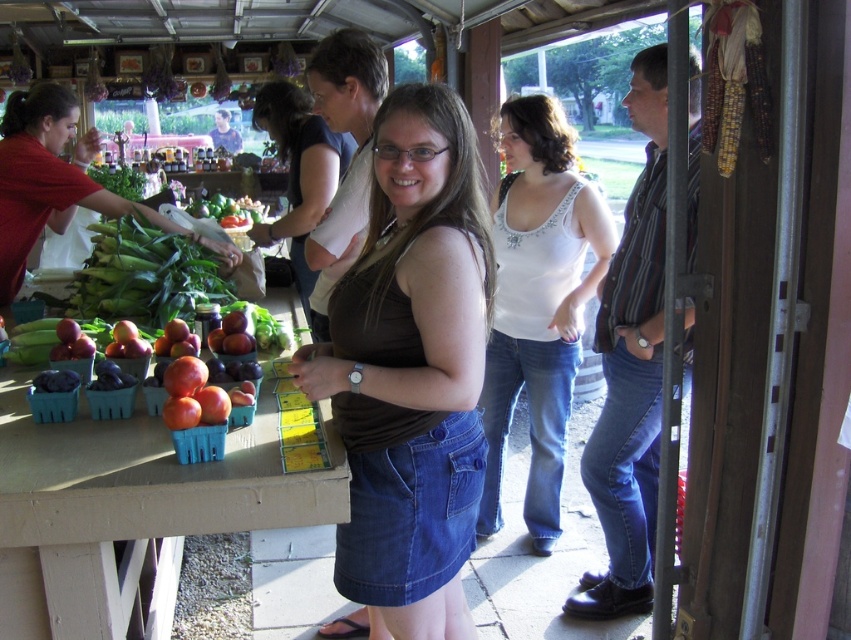
What is the exact coordinate of the matte black shirt at center?

The exact coordinate of the matte black shirt at center is at point (55, 180).

You are a customer at the farmer market who wants to pick up both the matte black shirt at center and the green leafy vegetables at center. Can you reach both items without moving your position? The average human arm span is about 1.5 meters.

The distance between the matte black shirt at center and the green leafy vegetables at center is 1.58 meters. Since the average human arm span is 1.5 meters, you might need to adjust your position slightly to reach both items.

You are a customer at the farmer market and see the white jersey at center and the green leafy vegetables at center on the table. Which item is placed lower on the table?

The white jersey at center is placed lower on the table because it is below the green leafy vegetables at center.